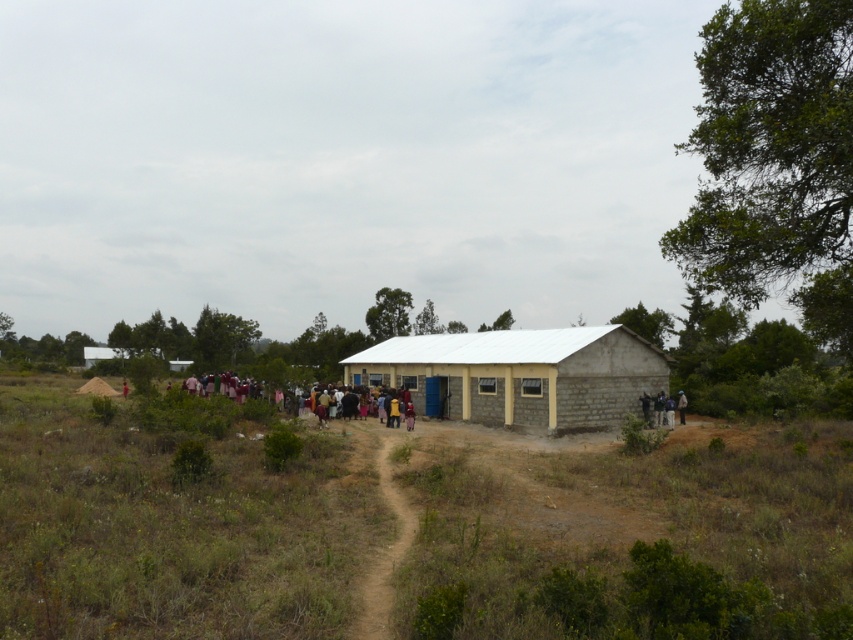
Identify the location of white corrugated metal hut at center. The height and width of the screenshot is (640, 853). pos(519,376).

Between brown soil at center and white corrugated metal hut at center, which one has more height?

white corrugated metal hut at center is taller.

In the scene shown: Between brown soil at center and white corrugated metal hut at center, which one is positioned lower?

brown soil at center is lower down.

Between point (344, 516) and point (498, 342), which one is positioned in front?

Point (344, 516) is more forward.

This screenshot has height=640, width=853. Identify the location of brown soil at center. (393, 524).

This screenshot has width=853, height=640. What do you see at coordinates (393, 524) in the screenshot?
I see `brown soil at center` at bounding box center [393, 524].

Which is more to the right, brown soil at center or multicolored fabric people at center?

brown soil at center

Who is more distant from viewer, (364, 452) or (213, 394)?

The point (213, 394) is behind.

At what (x,y) coordinates should I click in order to perform the action: click on brown soil at center. Please return your answer as a coordinate pair (x, y). This screenshot has height=640, width=853. Looking at the image, I should click on pyautogui.click(x=393, y=524).